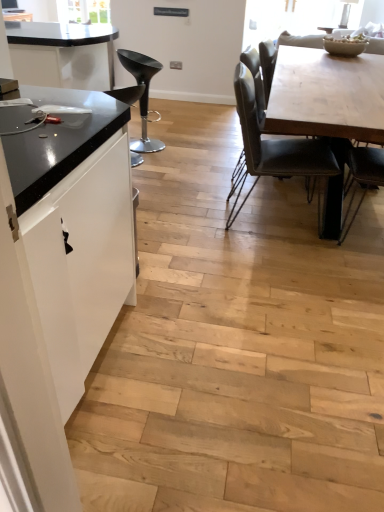
What do you see at coordinates (142, 95) in the screenshot? The height and width of the screenshot is (512, 384). I see `black plastic stool at left, the 2th chair viewed from the left` at bounding box center [142, 95].

Identify the location of black plastic stool at left, acting as the 2th chair starting from the right. The height and width of the screenshot is (512, 384). (142, 95).

Find the location of `light wood table at center`. light wood table at center is located at coordinates (327, 109).

Can you confirm if black leather bar stool at left, marked as the third chair in a right-to-left arrangement, is positioned to the left of black plastic stool at left, acting as the 2th chair starting from the right?

Yes, black leather bar stool at left, marked as the third chair in a right-to-left arrangement, is to the left of black plastic stool at left, acting as the 2th chair starting from the right.

Does point (136, 100) lie behind point (147, 109)?

Yes, it is behind point (147, 109).

Is black leather bar stool at left, marked as the third chair in a right-to-left arrangement, taller than black plastic stool at left, acting as the 2th chair starting from the right?

Incorrect, the height of black leather bar stool at left, marked as the third chair in a right-to-left arrangement, is not larger of that of black plastic stool at left, acting as the 2th chair starting from the right.

Is black leather bar stool at left, placed as the 1th chair when sorted from left to right, spatially inside black plastic stool at left, the 2th chair viewed from the left, or outside of it?

black leather bar stool at left, placed as the 1th chair when sorted from left to right, cannot be found inside black plastic stool at left, the 2th chair viewed from the left.

From the image's perspective, which is above, leatherette chair at center, the 1th chair when ordered from right to left, or black leather bar stool at left, marked as the third chair in a right-to-left arrangement?

black leather bar stool at left, marked as the third chair in a right-to-left arrangement, is shown above in the image.

Who is more distant, leatherette chair at center, the 1th chair when ordered from right to left, or black leather bar stool at left, placed as the 1th chair when sorted from left to right?

Positioned behind is black leather bar stool at left, placed as the 1th chair when sorted from left to right.

From a real-world perspective, is leatherette chair at center, the 1th chair when ordered from right to left, above or below black leather bar stool at left, marked as the third chair in a right-to-left arrangement?

leatherette chair at center, the 1th chair when ordered from right to left, is situated higher than black leather bar stool at left, marked as the third chair in a right-to-left arrangement, in the real world.

Is black leather bar stool at left, marked as the third chair in a right-to-left arrangement, facing towards light wood table at center?

No, black leather bar stool at left, marked as the third chair in a right-to-left arrangement, is not turned towards light wood table at center.

Is point (135, 161) positioned after point (372, 72)?

Yes, point (135, 161) is behind point (372, 72).

In terms of size, does black leather bar stool at left, marked as the third chair in a right-to-left arrangement, appear bigger or smaller than light wood table at center?

Considering their sizes, black leather bar stool at left, marked as the third chair in a right-to-left arrangement, takes up less space than light wood table at center.

From the picture: Can you tell me how much black leather bar stool at left, marked as the third chair in a right-to-left arrangement, and light wood table at center differ in facing direction?

They differ by 43.4 degrees in their facing directions.

Between leatherette chair at center, the 3th chair viewed from the left, and white matte cabinet at left, which one has larger width?

leatherette chair at center, the 3th chair viewed from the left.

From the image's perspective, would you say leatherette chair at center, the 3th chair viewed from the left, is positioned over white matte cabinet at left?

Yes.

Is leatherette chair at center, the 3th chair viewed from the left, to the left of white matte cabinet at left from the viewer's perspective?

Incorrect, leatherette chair at center, the 3th chair viewed from the left, is not on the left side of white matte cabinet at left.

Can you tell me how much black leather bar stool at left, marked as the third chair in a right-to-left arrangement, and leatherette chair at center, the 1th chair when ordered from right to left, differ in facing direction?

The angular difference between black leather bar stool at left, marked as the third chair in a right-to-left arrangement, and leatherette chair at center, the 1th chair when ordered from right to left, is 132 degrees.

Between black leather bar stool at left, placed as the 1th chair when sorted from left to right, and leatherette chair at center, the 3th chair viewed from the left, which one is positioned behind?

black leather bar stool at left, placed as the 1th chair when sorted from left to right, is behind.

From the image's perspective, would you say black leather bar stool at left, placed as the 1th chair when sorted from left to right, is positioned over leatherette chair at center, the 1th chair when ordered from right to left?

Yes, from the image's perspective, black leather bar stool at left, placed as the 1th chair when sorted from left to right, is on top of leatherette chair at center, the 1th chair when ordered from right to left.

From a real-world perspective, who is located higher, black leather bar stool at left, marked as the third chair in a right-to-left arrangement, or leatherette chair at center, the 1th chair when ordered from right to left?

In real-world perspective, leatherette chair at center, the 1th chair when ordered from right to left, is above.

In terms of size, does leatherette chair at center, the 3th chair viewed from the left, appear bigger or smaller than light wood table at center?

leatherette chair at center, the 3th chair viewed from the left, is smaller than light wood table at center.

From a real-world perspective, is leatherette chair at center, the 1th chair when ordered from right to left, physically located above or below light wood table at center?

In terms of real-world spatial position, leatherette chair at center, the 1th chair when ordered from right to left, is above light wood table at center.

Is leatherette chair at center, the 1th chair when ordered from right to left, far away from light wood table at center?

Actually, leatherette chair at center, the 1th chair when ordered from right to left, and light wood table at center are a little close together.

Locate an element on the screen. chair below the light wood table at center (from the image's perspective) is located at coordinates coord(275,148).

Which is behind, point (119, 95) or point (126, 225)?

The point (119, 95) is behind.

Looking at this image, is black leather bar stool at left, placed as the 1th chair when sorted from left to right, taller or shorter than white matte cabinet at left?

Clearly, black leather bar stool at left, placed as the 1th chair when sorted from left to right, is shorter compared to white matte cabinet at left.

At what (x,y) coordinates should I click in order to perform the action: click on cabinetry below the black leather bar stool at left, placed as the 1th chair when sorted from left to right (from the image's perspective). Please return your answer as a coordinate pair (x, y). Looking at the image, I should click on (58, 275).

Considering the relative positions of black leather bar stool at left, placed as the 1th chair when sorted from left to right, and white matte cabinet at left in the image provided, is black leather bar stool at left, placed as the 1th chair when sorted from left to right, in front of white matte cabinet at left?

No, it is behind white matte cabinet at left.

Find the location of a particular element. Image resolution: width=384 pixels, height=512 pixels. the 1st chair positioned below the black plastic stool at left, acting as the 2th chair starting from the right (from the image's perspective) is located at coordinates (127, 94).

The height and width of the screenshot is (512, 384). Identify the location of chair that is the 1st one when counting upward from the leatherette chair at center, the 1th chair when ordered from right to left (from the image's perspective). (127, 94).

From the image, which object appears to be nearer to leatherette chair at center, the 1th chair when ordered from right to left, black leather bar stool at left, placed as the 1th chair when sorted from left to right, or light wood table at center?

light wood table at center is positioned closer to the anchor leatherette chair at center, the 1th chair when ordered from right to left.

From the image, which object appears to be nearer to white matte cabinet at left, black leather bar stool at left, marked as the third chair in a right-to-left arrangement, or light wood table at center?

The object closer to white matte cabinet at left is light wood table at center.

Looking at the image, which one is located closer to black plastic stool at left, the 2th chair viewed from the left, light wood table at center or leatherette chair at center, the 1th chair when ordered from right to left?

Based on the image, leatherette chair at center, the 1th chair when ordered from right to left, appears to be nearer to black plastic stool at left, the 2th chair viewed from the left.

From the image, which object appears to be farther from leatherette chair at center, the 1th chair when ordered from right to left, black plastic stool at left, the 2th chair viewed from the left, or black leather bar stool at left, placed as the 1th chair when sorted from left to right?

black leather bar stool at left, placed as the 1th chair when sorted from left to right, is further to leatherette chair at center, the 1th chair when ordered from right to left.

From the image, which object appears to be nearer to light wood table at center, leatherette chair at center, the 1th chair when ordered from right to left, or black leather bar stool at left, marked as the third chair in a right-to-left arrangement?

leatherette chair at center, the 1th chair when ordered from right to left, lies closer to light wood table at center than the other object.

When comparing their distances from light wood table at center, does black plastic stool at left, acting as the 2th chair starting from the right, or black leather bar stool at left, placed as the 1th chair when sorted from left to right, seem further?

black leather bar stool at left, placed as the 1th chair when sorted from left to right.

Considering their positions, is light wood table at center positioned closer to leatherette chair at center, the 3th chair viewed from the left, than black leather bar stool at left, placed as the 1th chair when sorted from left to right?

light wood table at center is closer to leatherette chair at center, the 3th chair viewed from the left.

Looking at the image, which one is located further to black plastic stool at left, the 2th chair viewed from the left, black leather bar stool at left, placed as the 1th chair when sorted from left to right, or light wood table at center?

light wood table at center lies further to black plastic stool at left, the 2th chair viewed from the left, than the other object.

Where is `chair situated between black plastic stool at left, acting as the 2th chair starting from the right, and light wood table at center from left to right`? The height and width of the screenshot is (512, 384). chair situated between black plastic stool at left, acting as the 2th chair starting from the right, and light wood table at center from left to right is located at coordinates (275, 148).

I want to click on table between white matte cabinet at left and black plastic stool at left, the 2th chair viewed from the left, from front to back, so click(x=327, y=109).

This screenshot has width=384, height=512. In order to click on table positioned between white matte cabinet at left and black leather bar stool at left, marked as the third chair in a right-to-left arrangement, from near to far in this screenshot , I will do `click(327, 109)`.

Identify the location of chair located between black leather bar stool at left, placed as the 1th chair when sorted from left to right, and leatherette chair at center, the 1th chair when ordered from right to left, in the left-right direction. The height and width of the screenshot is (512, 384). (142, 95).